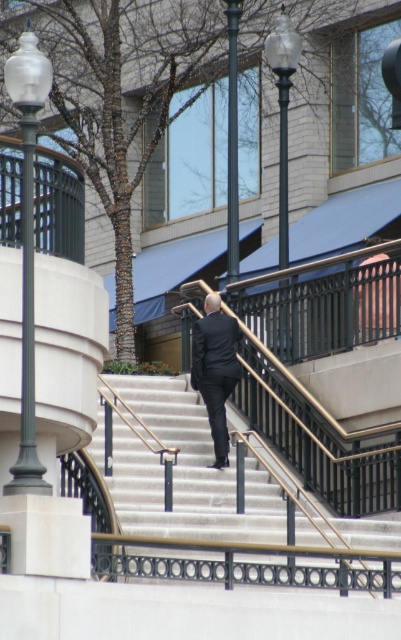
You are a delivery person carrying a heavy box and need to ascend the stairs. The polished brass handrail at center is slippery. Can you safely use the handrail while climbing the smooth concrete stairs at center?

The smooth concrete stairs at center is in front of polished brass handrail at center, so the handrail is behind the stairs. This means the handrail is not positioned where you can reach it while climbing the stairs, making it unsafe to use. You should avoid relying on the handrail in this situation.

Consider the image. You are standing at the bottom of the stairs in the image. The point marked as point [214,502] is located on the smooth concrete stairs at center. If you were to walk straight ahead, would you step onto the smooth concrete stairs at center first?

Yes, the point marked as point [214,502] is located on the smooth concrete stairs at center, so walking straight ahead would lead you to step onto the smooth concrete stairs at center first.